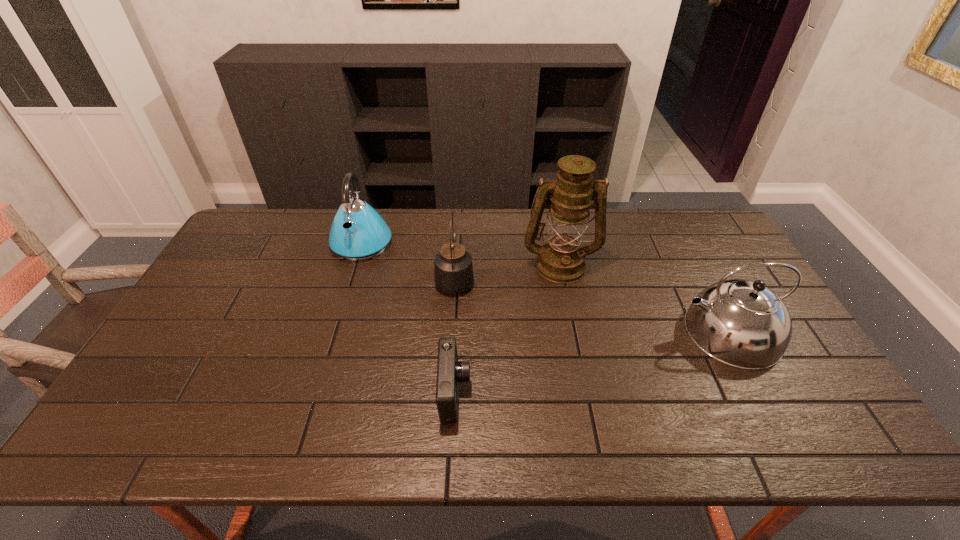
Image resolution: width=960 pixels, height=540 pixels. In the image, there is a desktop. What are the coordinates of `free space at the far edge` in the screenshot? It's located at (517, 227).

In the image, there is a desktop. What are the coordinates of `free space at the near edge` in the screenshot? It's located at (489, 449).

Locate an element on the screen. vacant space at the left edge of the desktop is located at coordinates (193, 329).

You are a GUI agent. You are given a task and a screenshot of the screen. Output one action in this format:
    pyautogui.click(x=<x>, y=<y>)
    Task: Click on the unoccupied position between the tallest object and the camera
    This screenshot has height=540, width=960.
    Given the screenshot: What is the action you would take?
    pyautogui.click(x=508, y=329)

This screenshot has height=540, width=960. In order to click on vacant region between the rightmost kettle and the oil lamp in this screenshot , I will do `click(644, 298)`.

Where is `free space between the oil lamp and the nearest kettle`? The image size is (960, 540). free space between the oil lamp and the nearest kettle is located at coordinates (644, 298).

The height and width of the screenshot is (540, 960). I want to click on free space between the second kettle from left to right and the leftmost object, so click(x=408, y=261).

You are a GUI agent. You are given a task and a screenshot of the screen. Output one action in this format:
    pyautogui.click(x=<x>, y=<y>)
    Task: Click on the free spot between the oil lamp and the rightmost kettle
    The width and height of the screenshot is (960, 540).
    Given the screenshot: What is the action you would take?
    pyautogui.click(x=644, y=298)

You are a GUI agent. You are given a task and a screenshot of the screen. Output one action in this format:
    pyautogui.click(x=<x>, y=<y>)
    Task: Click on the vacant space in between the second kettle from left to right and the leftmost kettle
    This screenshot has width=960, height=540.
    Given the screenshot: What is the action you would take?
    pyautogui.click(x=408, y=261)

I want to click on free space between the leftmost object and the camera, so click(408, 318).